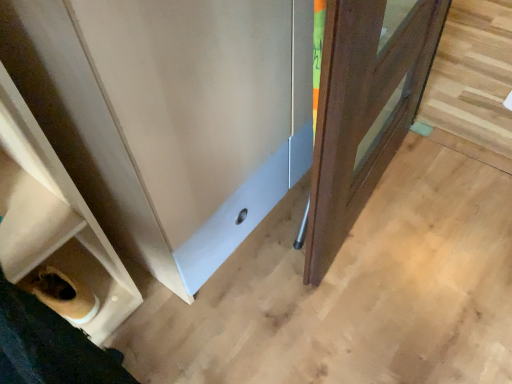
You are a GUI agent. You are given a task and a screenshot of the screen. Output one action in this format:
    pyautogui.click(x=<x>, y=<y>)
    Task: Click on the white matte shelf at lower left
    
    Given the screenshot: What is the action you would take?
    pyautogui.click(x=55, y=224)

What do you see at coordinates (55, 224) in the screenshot? I see `white matte shelf at lower left` at bounding box center [55, 224].

What do you see at coordinates (364, 108) in the screenshot? The height and width of the screenshot is (384, 512). I see `wooden door at right` at bounding box center [364, 108].

I want to click on wooden door at right, so click(x=364, y=108).

Image resolution: width=512 pixels, height=384 pixels. Identify the location of white matte shelf at lower left. pos(55,224).

Would you say white matte shelf at lower left is to the left or to the right of wooden door at right in the picture?

white matte shelf at lower left is to the left of wooden door at right.

Is the position of white matte shelf at lower left more distant than that of wooden door at right?

No, it is in front of wooden door at right.

Which is nearer, (8,228) or (336,143)?

Positioned in front is point (336,143).

From the image's perspective, is white matte shelf at lower left on top of wooden door at right?

Actually, white matte shelf at lower left appears below wooden door at right in the image.

From a real-world perspective, is white matte shelf at lower left on top of wooden door at right?

Yes, from a real-world perspective, white matte shelf at lower left is on top of wooden door at right.

Is white matte shelf at lower left thinner than wooden door at right?

Yes.

Considering the sizes of white matte shelf at lower left and wooden door at right in the image, is white matte shelf at lower left taller or shorter than wooden door at right?

In the image, white matte shelf at lower left appears to be taller than wooden door at right.

Who is smaller, white matte shelf at lower left or wooden door at right?

Smaller between the two is white matte shelf at lower left.

Can we say white matte shelf at lower left lies outside wooden door at right?

Yes, white matte shelf at lower left is outside of wooden door at right.

Is the surface of white matte shelf at lower left in direct contact with wooden door at right?

They are not placed beside each other.

Is white matte shelf at lower left aimed at wooden door at right?

No, white matte shelf at lower left is not oriented towards wooden door at right.

The image size is (512, 384). I want to click on shelf positioned vertically above the wooden door at right (from a real-world perspective), so click(55, 224).

Between wooden door at right and white matte shelf at lower left, which one appears on the right side from the viewer's perspective?

From the viewer's perspective, wooden door at right appears more on the right side.

Is wooden door at right positioned behind white matte shelf at lower left?

Yes, it is.

Is point (401, 38) more distant than point (77, 266)?

No, (401, 38) is in front of (77, 266).

From the image's perspective, which is below, wooden door at right or white matte shelf at lower left?

white matte shelf at lower left is shown below in the image.

From a real-world perspective, which is physically below, wooden door at right or white matte shelf at lower left?

In real-world perspective, wooden door at right is lower.

Is wooden door at right wider than white matte shelf at lower left?

Yes.

Can you confirm if wooden door at right is taller than white matte shelf at lower left?

Incorrect, the height of wooden door at right is not larger of that of white matte shelf at lower left.

Can you confirm if wooden door at right is bigger than white matte shelf at lower left?

Yes, wooden door at right is bigger than white matte shelf at lower left.

Which is correct: wooden door at right is inside white matte shelf at lower left, or outside of it?

wooden door at right is not enclosed by white matte shelf at lower left.

Looking at this image, is the surface of wooden door at right in direct contact with white matte shelf at lower left?

No, wooden door at right is not making contact with white matte shelf at lower left.

Consider the image. Is wooden door at right facing towards white matte shelf at lower left?

Yes.

How different are the orientations of wooden door at right and white matte shelf at lower left in degrees?

There is a 2.72-degree angle between the facing directions of wooden door at right and white matte shelf at lower left.

Based on the photo, how distant is wooden door at right from white matte shelf at lower left?

wooden door at right and white matte shelf at lower left are 24.76 inches apart.

The image size is (512, 384). Identify the location of door behind the white matte shelf at lower left. (364, 108).

At what (x,y) coordinates should I click in order to perform the action: click on door that appears below the white matte shelf at lower left (from a real-world perspective). Please return your answer as a coordinate pair (x, y). Looking at the image, I should click on (364, 108).

The width and height of the screenshot is (512, 384). Identify the location of door behind the white matte shelf at lower left. (364, 108).